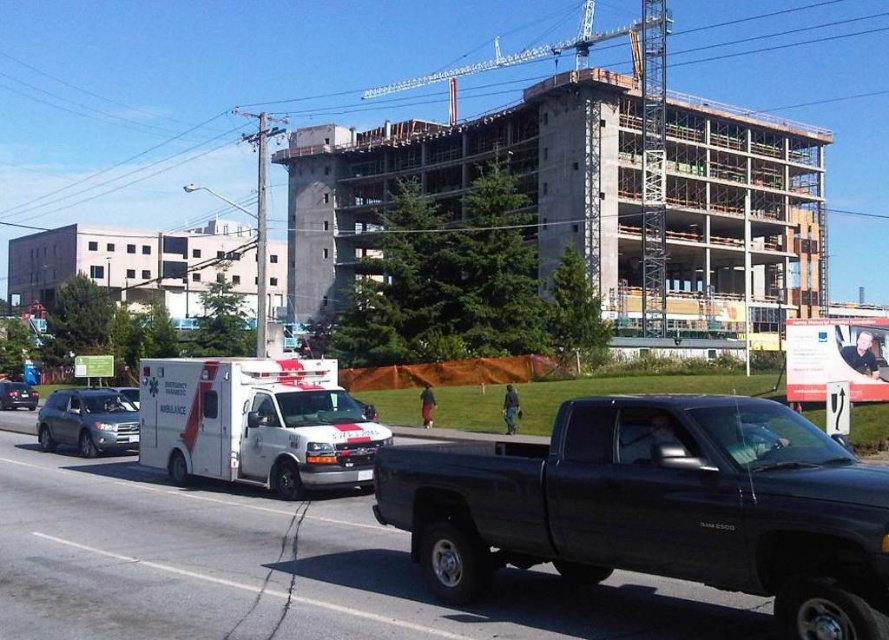
Question: Observing the image, what is the correct spatial positioning of matte black pickup truck at center in reference to concrete building at center?

Choices:
 (A) below
 (B) above

Answer: (A)

Question: Which object is farther from the camera taking this photo?

Choices:
 (A) matte black pickup truck at center
 (B) white glossy ambulance at center

Answer: (B)

Question: Among these objects, which one is farthest from the camera?

Choices:
 (A) metallic silver car at left
 (B) matte gray suv at left

Answer: (A)

Question: Is matte black pickup truck at center above white glossy ambulance at center?

Choices:
 (A) no
 (B) yes

Answer: (B)

Question: Which object appears closest to the camera in this image?

Choices:
 (A) metallic silver car at left
 (B) matte black pickup truck at center

Answer: (B)

Question: Does matte gray suv at left appear over metallic silver car at left?

Choices:
 (A) no
 (B) yes

Answer: (B)